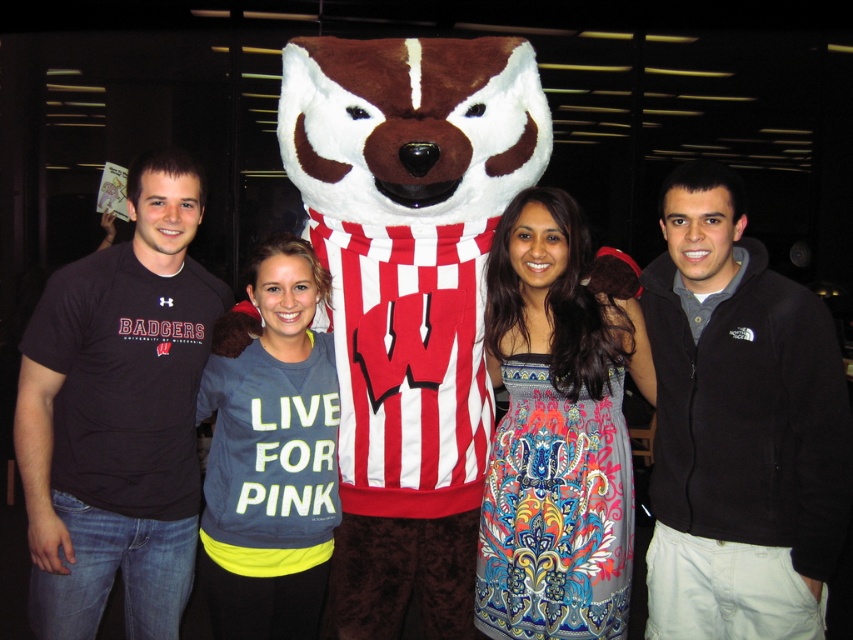
Question: Among these objects, which one is nearest to the camera?

Choices:
 (A) fuzzy brown and white mascot at center
 (B) printed silk dress at center

Answer: (A)

Question: Is the position of printed silk dress at center more distant than that of dark blue jersey at center?

Choices:
 (A) no
 (B) yes

Answer: (A)

Question: Which of the following is the farthest from the observer?

Choices:
 (A) printed silk dress at center
 (B) dark gray t-shirt at left
 (C) dark blue jersey at center
 (D) dark gray fleece jacket at right

Answer: (C)

Question: Is fuzzy brown and white mascot at center behind dark gray t-shirt at left?

Choices:
 (A) no
 (B) yes

Answer: (A)

Question: Which of the following is the farthest from the observer?

Choices:
 (A) dark gray t-shirt at left
 (B) dark gray fleece jacket at right

Answer: (A)

Question: Where is fuzzy brown and white mascot at center located in relation to dark gray t-shirt at left in the image?

Choices:
 (A) left
 (B) right

Answer: (B)